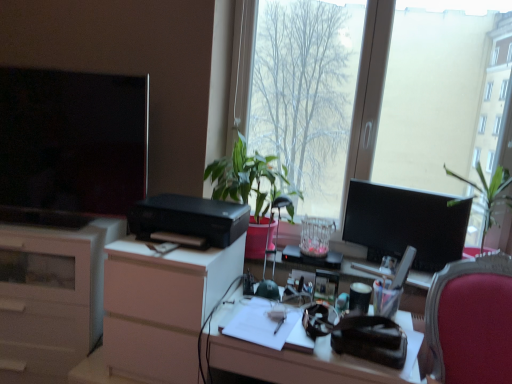
Question: Which is correct: matte black desk at center is inside green leafy plant at center, or outside of it?

Choices:
 (A) outside
 (B) inside

Answer: (A)

Question: Considering the positions of point (403, 370) and point (245, 175), is point (403, 370) closer or farther from the camera than point (245, 175)?

Choices:
 (A) closer
 (B) farther

Answer: (A)

Question: Considering the real-world distances, which object is farthest from the matte black desk at center?

Choices:
 (A) transparent glass window at center
 (B) matte black television at left, acting as the 1th television starting from the left
 (C) translucent glass vase at center
 (D) white matte dresser at center
 (E) velvet red chair at right

Answer: (A)

Question: Which object is the closest to the white matte dresser at center?

Choices:
 (A) translucent glass vase at center
 (B) velvet red chair at right
 (C) green leafy plant at center
 (D) black plastic printer at center
 (E) white paper at center

Answer: (D)